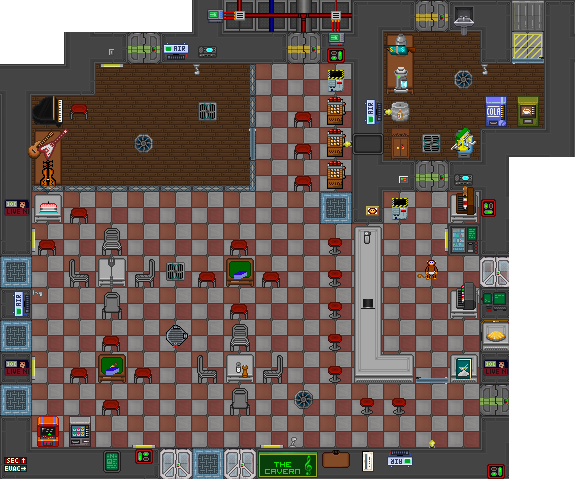
Where is `gray chairs`? Image resolution: width=575 pixels, height=479 pixels. gray chairs is located at coordinates point(240,395), point(274,371), point(245,338), point(202,369), point(115,307), point(150,277), point(115,243), point(76,275).